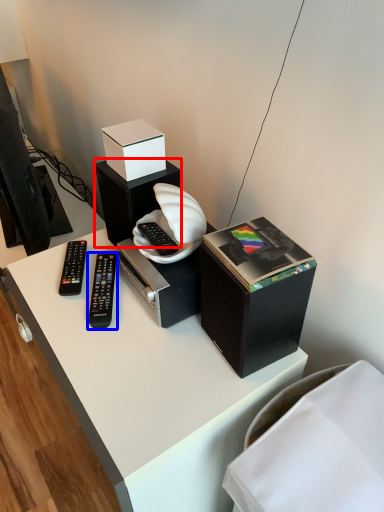
Question: Which object appears farthest to the camera in this image, speaker (highlighted by a red box) or remote control (highlighted by a blue box)?

Choices:
 (A) speaker
 (B) remote control

Answer: (A)